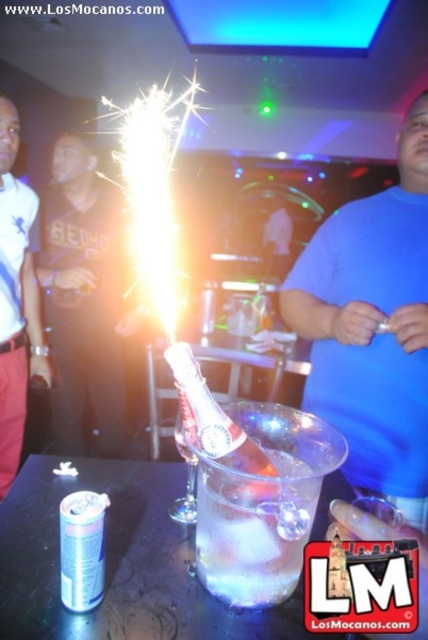
Question: Is the position of blue matte shirt at center more distant than that of black cotton shirt at center?

Choices:
 (A) no
 (B) yes

Answer: (A)

Question: Which of these objects is positioned closest to the clear glass ice bucket at center?

Choices:
 (A) black cotton shirt at center
 (B) blue matte shirt at center
 (C) clear glass bottle at center

Answer: (C)

Question: Which of the following is the farthest from the observer?

Choices:
 (A) brushed metal shirt at left
 (B) clear plastic ice bucket at center
 (C) clear glass bottle at center
 (D) blue matte shirt at center

Answer: (A)

Question: Is blue matte shirt at center further to camera compared to clear glass ice bucket at center?

Choices:
 (A) yes
 (B) no

Answer: (A)

Question: Is black cotton shirt at center smaller than clear glass bottle at center?

Choices:
 (A) no
 (B) yes

Answer: (A)

Question: Among these objects, which one is farthest from the camera?

Choices:
 (A) clear plastic ice bucket at center
 (B) clear glass bottle at center
 (C) brushed metal shirt at left

Answer: (C)